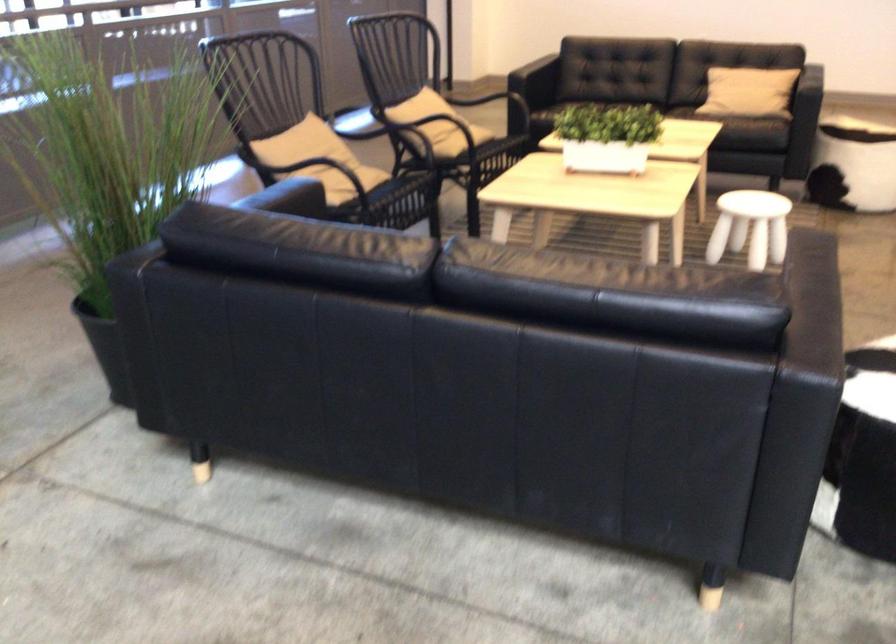
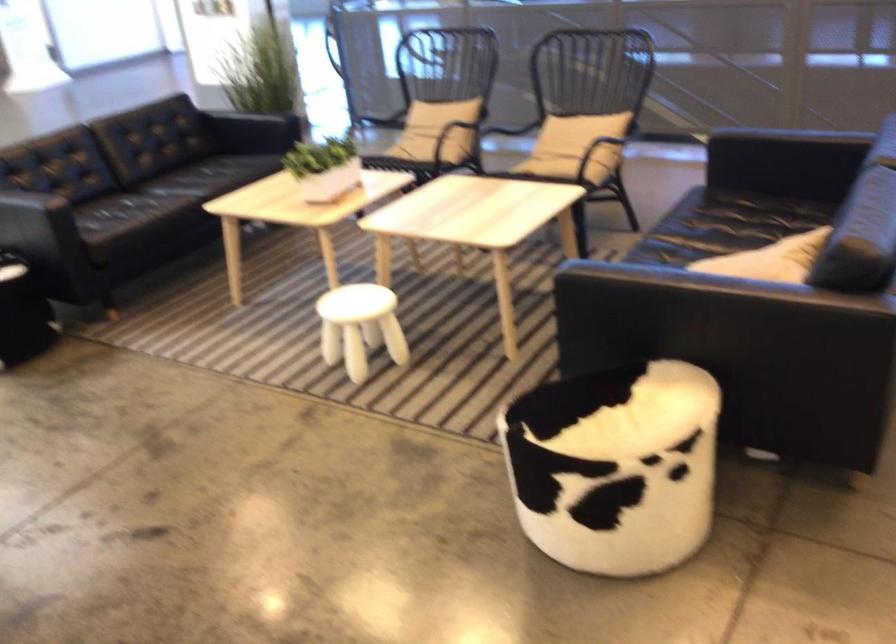
Where in the second image is the point corresponding to (627,129) from the first image?

(323, 167)